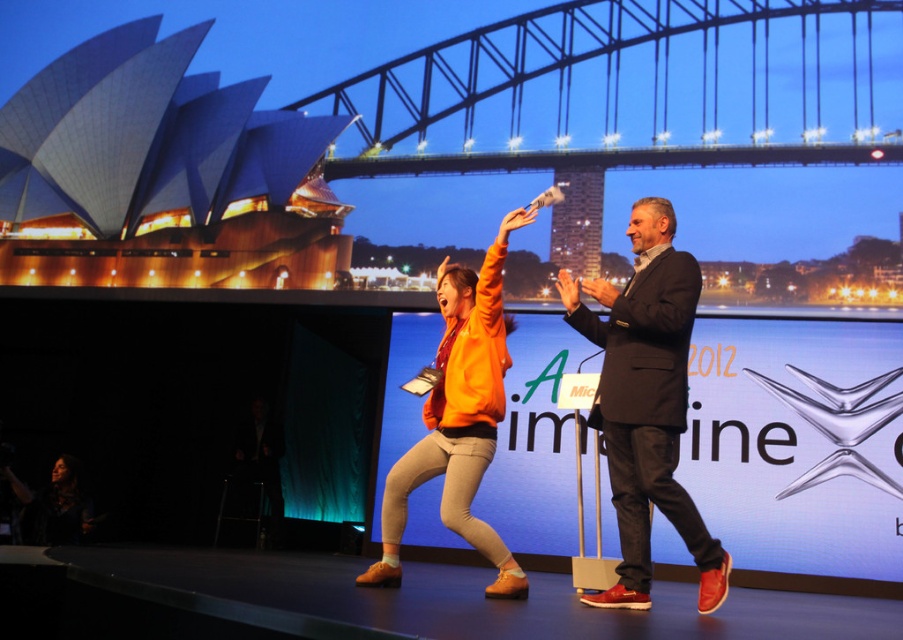
You are a photographer positioned at point (647, 403). You want to take a photo of the dark gray suit at center. Is the dark gray suit at center visible from your current position?

Yes, the dark gray suit at center is visible from point (647, 403) as it is located at that exact position.

You are a photographer on the stage and want to take a photo of the orange matte jacket at center and orange suede shoes at center. Which object should you focus on first if you need to capture them both in the frame without moving the camera?

The orange suede shoes at center should be focused on first because the orange matte jacket at center is to the right of the orange suede shoes at center, so adjusting focus from the shoes to the jacket would keep both in frame without moving the camera.